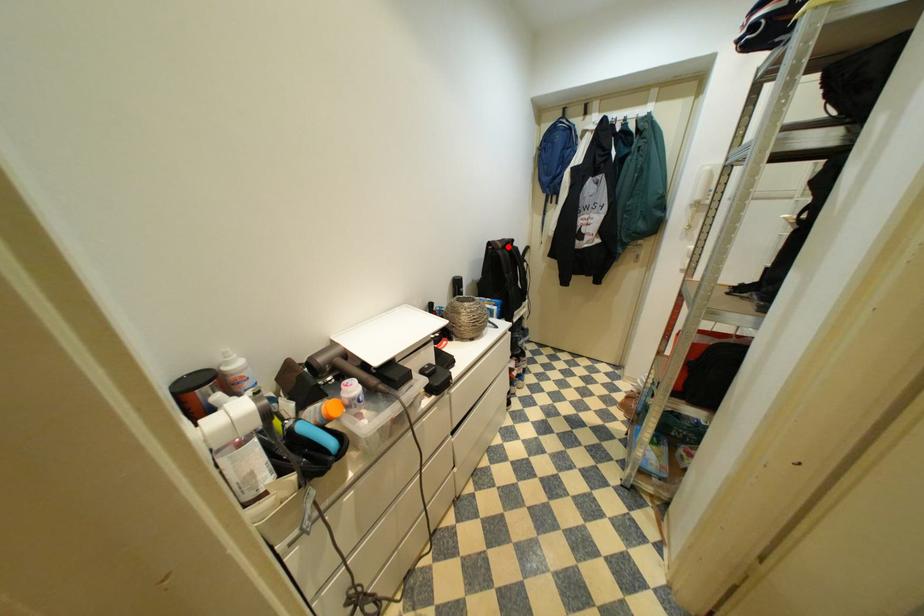
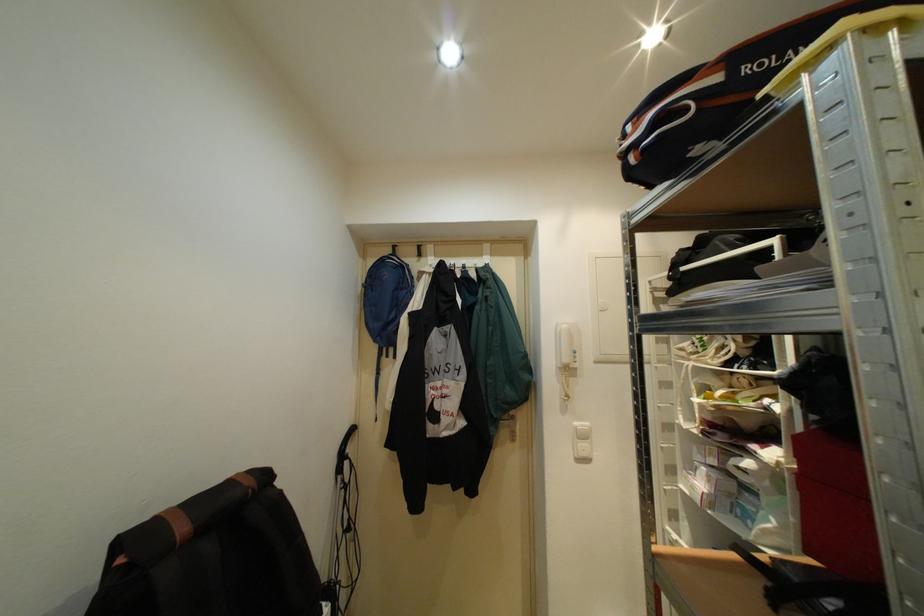
The point at the highlighted location is marked in the first image. Where is the corresponding point in the second image?

(191, 530)